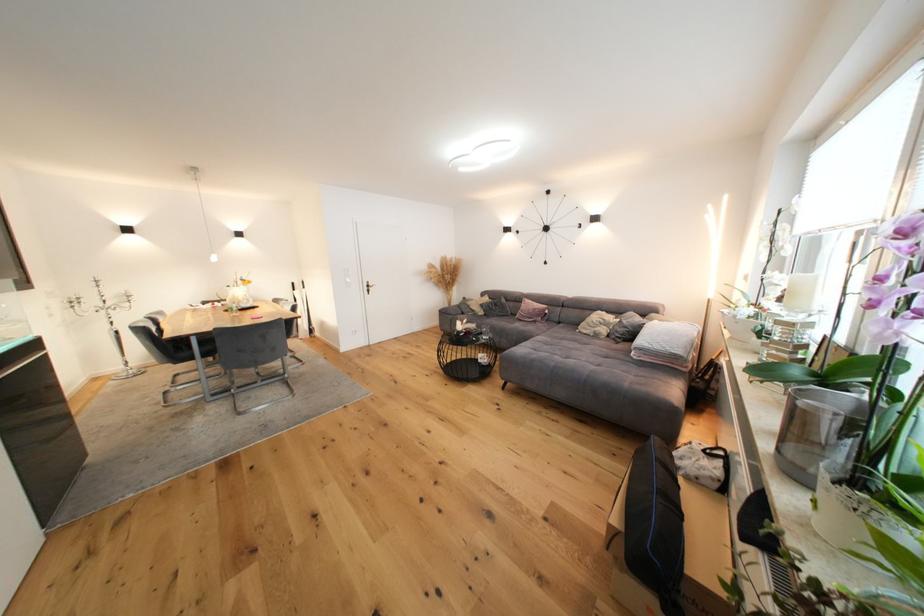
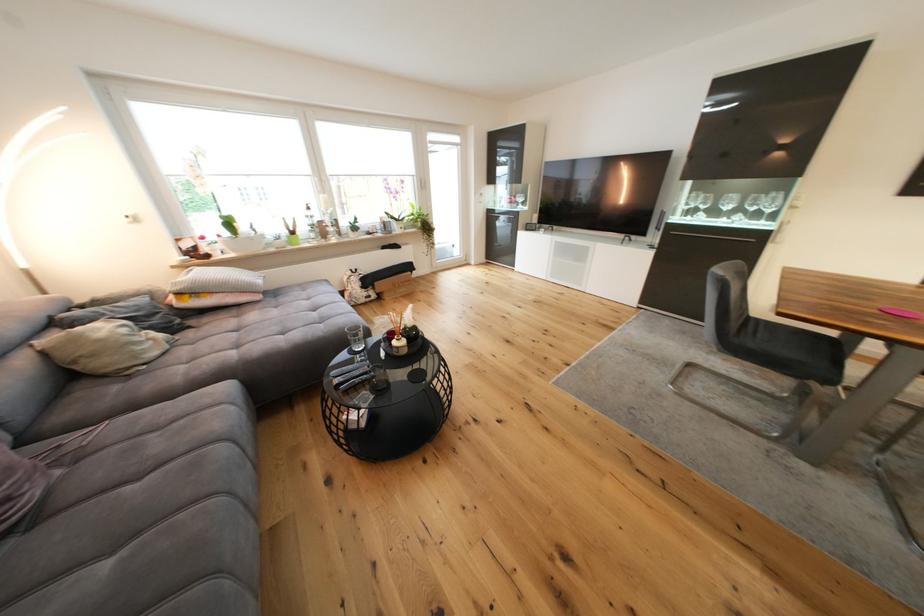
In the second image, find the point that corresponds to pixel 602 338 in the first image.

(178, 345)